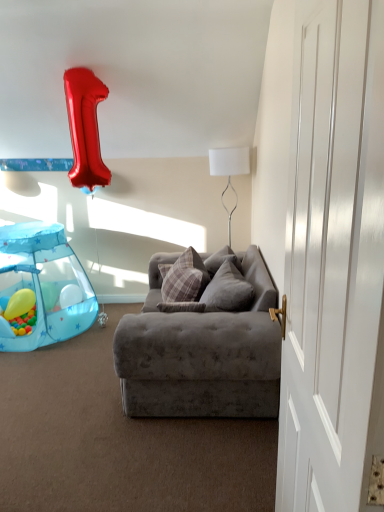
Question: Is plaid fabric pillow at center, which is counted as the 2th pillow, starting from the right, to the left of white smooth door at right from the viewer's perspective?

Choices:
 (A) no
 (B) yes

Answer: (B)

Question: Is white smooth door at right at the back of plaid fabric pillow at center, which appears as the first pillow when viewed from the left?

Choices:
 (A) yes
 (B) no

Answer: (B)

Question: Is plaid fabric pillow at center, which is counted as the 2th pillow, starting from the right, next to white smooth door at right and touching it?

Choices:
 (A) no
 (B) yes

Answer: (A)

Question: Can you confirm if plaid fabric pillow at center, which appears as the first pillow when viewed from the left, is shorter than white smooth door at right?

Choices:
 (A) yes
 (B) no

Answer: (A)

Question: Does plaid fabric pillow at center, which appears as the first pillow when viewed from the left, turn towards white smooth door at right?

Choices:
 (A) no
 (B) yes

Answer: (A)

Question: Based on their positions, is velvet gray couch at center located to the left or right of plush gray pillow at center, arranged as the 2th pillow when viewed from the left?

Choices:
 (A) right
 (B) left

Answer: (B)

Question: Is velvet gray couch at center bigger or smaller than plush gray pillow at center, arranged as the 2th pillow when viewed from the left?

Choices:
 (A) small
 (B) big

Answer: (B)

Question: From a real-world perspective, relative to plush gray pillow at center, arranged as the first pillow when viewed from the right, is velvet gray couch at center vertically above or below?

Choices:
 (A) below
 (B) above

Answer: (A)

Question: In terms of width, does velvet gray couch at center look wider or thinner when compared to plush gray pillow at center, arranged as the first pillow when viewed from the right?

Choices:
 (A) wide
 (B) thin

Answer: (A)

Question: From the image's perspective, is yellow rubber balloon at lower left located above or below plush gray pillow at center, arranged as the first pillow when viewed from the right?

Choices:
 (A) above
 (B) below

Answer: (B)

Question: In terms of width, does yellow rubber balloon at lower left look wider or thinner when compared to plush gray pillow at center, arranged as the first pillow when viewed from the right?

Choices:
 (A) thin
 (B) wide

Answer: (A)

Question: In terms of height, does yellow rubber balloon at lower left look taller or shorter compared to plush gray pillow at center, arranged as the 2th pillow when viewed from the left?

Choices:
 (A) tall
 (B) short

Answer: (B)

Question: From a real-world perspective, relative to plush gray pillow at center, arranged as the 2th pillow when viewed from the left, is yellow rubber balloon at lower left vertically above or below?

Choices:
 (A) below
 (B) above

Answer: (A)

Question: Is white smooth door at right wider or thinner than plaid fabric pillow at center, which appears as the first pillow when viewed from the left?

Choices:
 (A) wide
 (B) thin

Answer: (B)

Question: From the image's perspective, is white smooth door at right located above or below plaid fabric pillow at center, which appears as the first pillow when viewed from the left?

Choices:
 (A) above
 (B) below

Answer: (B)